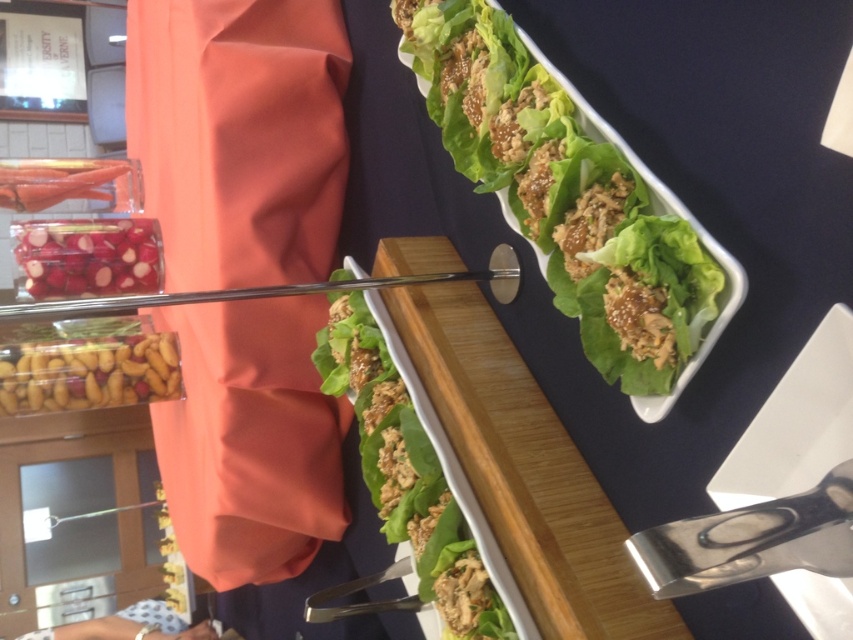
Question: Can you confirm if smooth red radish at left is wider than glossy plastic bag at upper left?

Choices:
 (A) no
 (B) yes

Answer: (B)

Question: Does green leafy lettuce at center have a larger size compared to smooth red radish at left?

Choices:
 (A) yes
 (B) no

Answer: (A)

Question: Which of the following is the farthest from the observer?

Choices:
 (A) smooth red radish at left
 (B) glossy plastic bag at upper left
 (C) green leafy lettuce at upper right

Answer: (B)

Question: Which of the following is the closest to the observer?

Choices:
 (A) green leafy lettuce at upper right
 (B) translucent plastic container at lower left

Answer: (A)

Question: Does green leafy lettuce at upper right have a greater width compared to glossy plastic bag at upper left?

Choices:
 (A) no
 (B) yes

Answer: (B)

Question: Considering the real-world distances, which object is farthest from the glossy plastic bag at upper left?

Choices:
 (A) smooth red radish at left
 (B) translucent plastic container at lower left
 (C) green leafy lettuce at center
 (D) green leafy lettuce at upper right

Answer: (D)